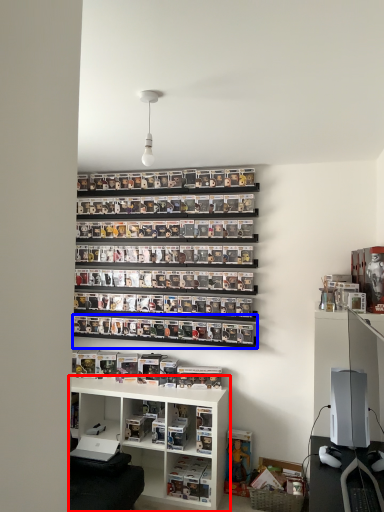
Question: Among these objects, which one is nearest to the camera, shelf (highlighted by a red box) or shelf (highlighted by a blue box)?

Choices:
 (A) shelf
 (B) shelf

Answer: (A)